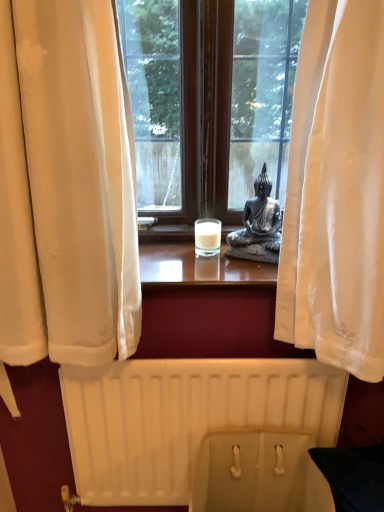
Where is `vacant area that lies to the right of white frosted glass candle at center`? This screenshot has width=384, height=512. vacant area that lies to the right of white frosted glass candle at center is located at coordinates (247, 260).